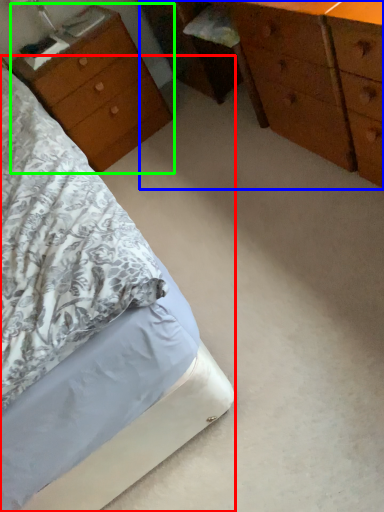
Question: Which is nearer to the bed (highlighted by a red box)? chest of drawers (highlighted by a blue box) or nightstand (highlighted by a green box).

Choices:
 (A) chest of drawers
 (B) nightstand

Answer: (B)